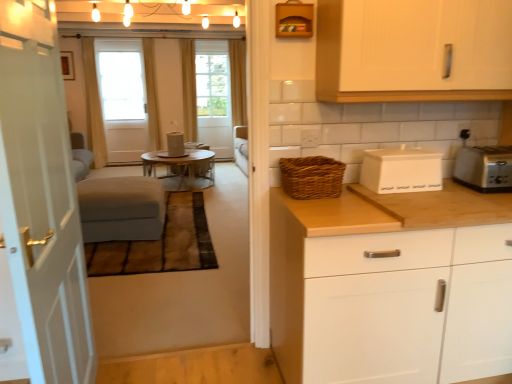
What do you see at coordinates (151, 93) in the screenshot? The image size is (512, 384). I see `beige fabric curtain at center, acting as the 3th curtain starting from the right` at bounding box center [151, 93].

How much space does beige fabric curtain at center, arranged as the second curtain when viewed from the left, occupy horizontally?

beige fabric curtain at center, arranged as the second curtain when viewed from the left, is 9.50 inches wide.

The width and height of the screenshot is (512, 384). What do you see at coordinates (175, 144) in the screenshot? I see `matte gray cylinder at center, positioned as the 2th appliance in right-to-left order` at bounding box center [175, 144].

At what (x,y) coordinates should I click in order to perform the action: click on clear glass screen door at center, the 2th screen door viewed from the left. Please return your answer as a coordinate pair (x, y). Image resolution: width=512 pixels, height=384 pixels. Looking at the image, I should click on (213, 96).

Describe the element at coordinates (121, 208) in the screenshot. This screenshot has height=384, width=512. I see `suede-like gray couch at left` at that location.

In order to click on beige fabric curtain at left, the 4th curtain positioned from the right in this screenshot , I will do `click(93, 105)`.

Considering the sizes of objects white matte bread box at upper right, which is counted as the 2th appliance, starting from the left, and metallic silver table at center in the image provided, who is thinner, white matte bread box at upper right, which is counted as the 2th appliance, starting from the left, or metallic silver table at center?

white matte bread box at upper right, which is counted as the 2th appliance, starting from the left.

Would you say metallic silver table at center is part of white matte bread box at upper right, the first appliance when ordered from front to back,'s contents?

No, metallic silver table at center is not inside white matte bread box at upper right, the first appliance when ordered from front to back.

Is white matte bread box at upper right, which ranks as the 2th appliance in top-to-bottom order, facing away from metallic silver table at center?

Yes, white matte bread box at upper right, which ranks as the 2th appliance in top-to-bottom order, is positioned with its back facing metallic silver table at center.

The height and width of the screenshot is (384, 512). I want to click on plain lying on the left of silver metallic toaster at right, so coord(160,244).

From the image's perspective, would you say silver metallic toaster at right is shown under velvet grey ottoman at center?

Actually, silver metallic toaster at right appears above velvet grey ottoman at center in the image.

Can velvet grey ottoman at center be found inside silver metallic toaster at right?

No, silver metallic toaster at right does not contain velvet grey ottoman at center.

Considering the relative sizes of silver metallic toaster at right and velvet grey ottoman at center in the image provided, is silver metallic toaster at right shorter than velvet grey ottoman at center?

No, silver metallic toaster at right is not shorter than velvet grey ottoman at center.

From their relative heights in the image, would you say white matte cabinet at right, the 2th cabinetry when ordered from top to bottom, is taller or shorter than matte gray cylinder at center, the 1th appliance positioned from the left?

In the image, white matte cabinet at right, the 2th cabinetry when ordered from top to bottom, appears to be taller than matte gray cylinder at center, the 1th appliance positioned from the left.

Could matte gray cylinder at center, which is the 2th appliance in front-to-back order, be considered to be inside white matte cabinet at right, the 2th cabinetry when ordered from top to bottom?

No, matte gray cylinder at center, which is the 2th appliance in front-to-back order, is not surrounded by white matte cabinet at right, the 2th cabinetry when ordered from top to bottom.

From the image's perspective, is white matte cabinet at right, the 2th cabinetry when ordered from top to bottom, below matte gray cylinder at center, the 1th appliance positioned from the left?

Yes, from the image's perspective, white matte cabinet at right, the 2th cabinetry when ordered from top to bottom, is beneath matte gray cylinder at center, the 1th appliance positioned from the left.

Considering the relative sizes of white matte cabinet at right, the 2th cabinetry when ordered from top to bottom, and matte gray cylinder at center, the first appliance in the top-to-bottom sequence, in the image provided, is white matte cabinet at right, the 2th cabinetry when ordered from top to bottom, smaller than matte gray cylinder at center, the first appliance in the top-to-bottom sequence,?

Incorrect, white matte cabinet at right, the 2th cabinetry when ordered from top to bottom, is not smaller in size than matte gray cylinder at center, the first appliance in the top-to-bottom sequence.

Can you confirm if white wooden door at left is thinner than beige fabric curtain at center, acting as the 3th curtain starting from the right?

Yes.

Can you confirm if white wooden door at left is bigger than beige fabric curtain at center, acting as the 3th curtain starting from the right?

Indeed, white wooden door at left has a larger size compared to beige fabric curtain at center, acting as the 3th curtain starting from the right.

Considering the sizes of objects white wooden door at left and beige fabric curtain at center, arranged as the second curtain when viewed from the left, in the image provided, who is shorter, white wooden door at left or beige fabric curtain at center, arranged as the second curtain when viewed from the left,?

Standing shorter between the two is white wooden door at left.

Is the position of white wooden door at left more distant than that of beige fabric curtain at center, acting as the 3th curtain starting from the right?

No.

How far apart are white wooden door at left and suede-like gray couch at left?

white wooden door at left and suede-like gray couch at left are 6.81 feet apart from each other.

Is suede-like gray couch at left located within white wooden door at left?

Actually, suede-like gray couch at left is outside white wooden door at left.

Is white wooden door at left facing away from suede-like gray couch at left?

white wooden door at left is not turned away from suede-like gray couch at left.

Considering the relative sizes of white wooden door at left and suede-like gray couch at left in the image provided, is white wooden door at left thinner than suede-like gray couch at left?

Correct, the width of white wooden door at left is less than that of suede-like gray couch at left.

The height and width of the screenshot is (384, 512). I want to click on appliance on the left side of metallic silver table at center, so click(175, 144).

Would you consider matte gray cylinder at center, the 1th appliance positioned from the left, to be distant from metallic silver table at center?

They are positioned close to each other.

From the image's perspective, is matte gray cylinder at center, which is the 2th appliance in front-to-back order, located beneath metallic silver table at center?

Actually, matte gray cylinder at center, which is the 2th appliance in front-to-back order, appears above metallic silver table at center in the image.

Considering the relative positions of woven brown basket at center and velvet grey ottoman at center in the image provided, is woven brown basket at center to the right of velvet grey ottoman at center from the viewer's perspective?

Yes.

At what (x,y) coordinates should I click in order to perform the action: click on plain behind the woven brown basket at center. Please return your answer as a coordinate pair (x, y). The width and height of the screenshot is (512, 384). Looking at the image, I should click on (160, 244).

Which is in front, point (313, 186) or point (190, 201)?

Positioned in front is point (313, 186).

From a real-world perspective, is woven brown basket at center located beneath velvet grey ottoman at center?

No.

The width and height of the screenshot is (512, 384). Identify the location of appliance that appears in front of the metallic silver table at center. (401, 170).

Where is `toaster on the right of the velvet grey ottoman at center`? This screenshot has height=384, width=512. toaster on the right of the velvet grey ottoman at center is located at coordinates (484, 168).

Estimate the real-world distances between objects in this image. Which object is closer to suede-like gray couch at left, clear glass screen door at center, the 1th screen door from the right, or white wooden door at left?

white wooden door at left is closer to suede-like gray couch at left.

Based on their spatial positions, is white matte cabinet at right, the 2th cabinetry when ordered from top to bottom, or clear glass screen door at upper left, the 1th screen door in the left-to-right sequence, closer to silver metallic toaster at right?

The object closer to silver metallic toaster at right is white matte cabinet at right, the 2th cabinetry when ordered from top to bottom.

Which object lies further to the anchor point clear glass screen door at upper left, the 1th screen door in the left-to-right sequence, yellow fabric curtain at upper center, the 4th curtain in the left-to-right sequence, or beige fabric curtain at left, the 4th curtain positioned from the right?

yellow fabric curtain at upper center, the 4th curtain in the left-to-right sequence, is positioned further to the anchor clear glass screen door at upper left, the 1th screen door in the left-to-right sequence.

Looking at the image, which one is located further to suede-like gray couch at left, clear glass screen door at center, the 2th screen door viewed from the left, or silver metallic toaster at right?

clear glass screen door at center, the 2th screen door viewed from the left.

Looking at the image, which one is located further to yellow fabric curtain at upper center, the 4th curtain in the left-to-right sequence, woven brown basket at center or white wood cabinet at upper right, arranged as the first cabinetry when viewed from the top?

white wood cabinet at upper right, arranged as the first cabinetry when viewed from the top.

Consider the image. Estimate the real-world distances between objects in this image. Which object is further from white wooden door at left, white matte cabinet at right, the 2th cabinetry when ordered from top to bottom, or clear glass screen door at center, the 1th screen door from the right?

Among the two, clear glass screen door at center, the 1th screen door from the right, is located further to white wooden door at left.

Based on their spatial positions, is silver metallic toaster at right or white matte bread box at upper right, the second appliance positioned from the back, closer to suede-like gray couch at left?

white matte bread box at upper right, the second appliance positioned from the back, is positioned closer to the anchor suede-like gray couch at left.

Looking at the image, which one is located closer to beige fabric curtain at center, acting as the 3th curtain starting from the right, white wood cabinet at upper right, arranged as the first cabinetry when viewed from the top, or velvet grey ottoman at center?

Among the two, velvet grey ottoman at center is located nearer to beige fabric curtain at center, acting as the 3th curtain starting from the right.

Identify the location of couch located between woven brown basket at center and clear glass screen door at upper left, the 1th screen door in the left-to-right sequence, in the depth direction. This screenshot has width=512, height=384. (121, 208).

Where is `appliance between white matte bread box at upper right, which is the first appliance in bottom-to-top order, and clear glass screen door at center, the 1th screen door from the right, from front to back`? This screenshot has height=384, width=512. appliance between white matte bread box at upper right, which is the first appliance in bottom-to-top order, and clear glass screen door at center, the 1th screen door from the right, from front to back is located at coordinates (175, 144).

I want to click on plain between silver metallic toaster at right and metallic silver table at center from front to back, so click(x=160, y=244).

Locate an element on the screen. The image size is (512, 384). table located between woven brown basket at center and beige fabric curtain at left, the 4th curtain positioned from the right, in the depth direction is located at coordinates (182, 169).